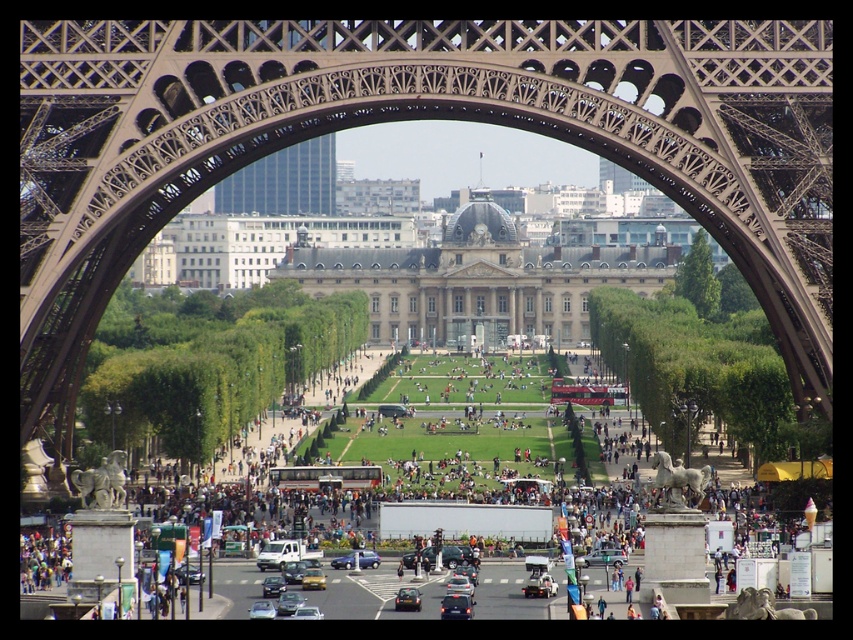
Which is more to the left, metallic brown eiffel tower at center or metallic blue sedan at center?

From the viewer's perspective, metallic blue sedan at center appears more on the left side.

Is metallic brown eiffel tower at center wider than metallic blue sedan at center?

Yes, metallic brown eiffel tower at center is wider than metallic blue sedan at center.

Does point (723, 243) come farther from viewer compared to point (340, 563)?

Yes.

You are a GUI agent. You are given a task and a screenshot of the screen. Output one action in this format:
    pyautogui.click(x=<x>, y=<y>)
    Task: Click on the metallic brown eiffel tower at center
    
    Given the screenshot: What is the action you would take?
    pyautogui.click(x=410, y=120)